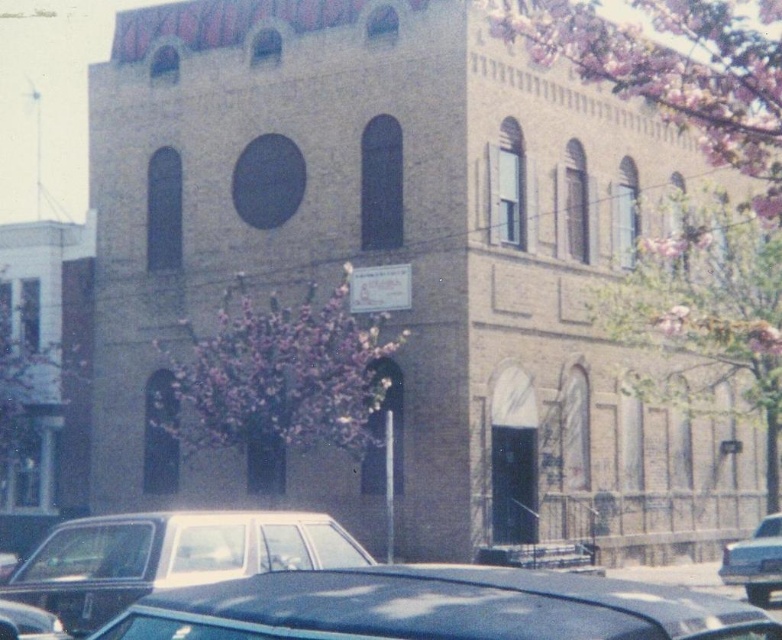
You are standing in front of the two story brick building. You see a point marked at coordinates (436, 608). What object is located at that point?

The point at coordinates (436, 608) marks a shiny black car at lower center.

You are a delivery driver who needs to park your truck between the shiny silver sedan at lower right and the shiny black car at lower left. Your truck requires at least 15 meters of space. Is there enough space between them?

The distance between the shiny silver sedan at lower right and the shiny black car at lower left is 15.01 meters, which is just enough space for the truck to park between them since it requires at least 15 meters.